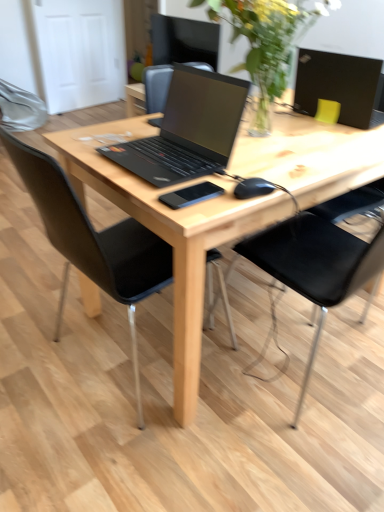
Question: Is black matte mouse at center wider or thinner than black matte laptop at upper right, placed as the 2th laptop when sorted from left to right?

Choices:
 (A) wide
 (B) thin

Answer: (B)

Question: Is black matte mouse at center situated inside black matte laptop at upper right, arranged as the first laptop when viewed from the right, or outside?

Choices:
 (A) inside
 (B) outside

Answer: (B)

Question: Based on their relative distances, which object is farther from the black matte laptop at center, which is counted as the 1th laptop, starting from the front?

Choices:
 (A) black leather chair at center, which is counted as the 2th chair, starting from the right
 (B) black matte laptop at upper right, arranged as the first laptop when viewed from the right
 (C) black matte mouse at center
 (D) black matte phone at center
 (E) black leather chair at center, which is counted as the 1th chair, starting from the right

Answer: (B)

Question: Considering the real-world distances, which object is farthest from the black matte laptop at center, which is the 1th laptop from left to right?

Choices:
 (A) black matte phone at center
 (B) black leather chair at center, acting as the 2th chair starting from the left
 (C) natural wood desk at center
 (D) black leather chair at center, which is counted as the 2th chair, starting from the right
 (E) black matte laptop at upper right, arranged as the first laptop when viewed from the right

Answer: (E)